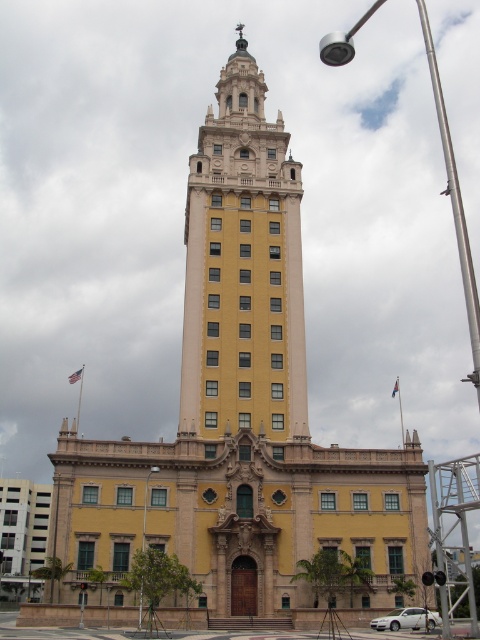
Is yellow stone tower at center further to the viewer compared to metallic pole at center?

Yes, yellow stone tower at center is further from the viewer.

Find the location of a particular element. Image resolution: width=480 pixels, height=640 pixels. yellow stone tower at center is located at coordinates (242, 268).

Between point (292, 176) and point (144, 525), which one is positioned behind?

The point (292, 176) is behind.

Locate an element on the screen. yellow stone tower at center is located at coordinates tap(242, 268).

Is silver metallic pole at upper center below metallic pole at center?

Incorrect, silver metallic pole at upper center is not positioned below metallic pole at center.

Does point (472, 374) lie in front of point (140, 618)?

No.

You are a GUI agent. You are given a task and a screenshot of the screen. Output one action in this format:
    pyautogui.click(x=<x>, y=<y>)
    Task: Click on the silver metallic pole at upper center
    Image resolution: width=480 pixels, height=640 pixels.
    Given the screenshot: What is the action you would take?
    pyautogui.click(x=455, y=204)

Looking at this image, can you confirm if yellow stone tower at center is thinner than silver metallic pole at upper center?

Correct, yellow stone tower at center's width is less than silver metallic pole at upper center's.

Based on the photo, can you confirm if yellow stone tower at center is smaller than silver metallic pole at upper center?

Yes.

Find the location of a particular element. This screenshot has height=640, width=480. yellow stone tower at center is located at coordinates (242, 268).